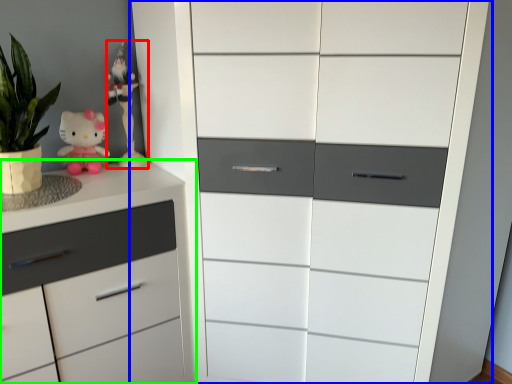
Question: Which object is the farthest from miniature (highlighted by a red box)? Choose among these: chest of drawers (highlighted by a blue box) or chest of drawers (highlighted by a green box).

Choices:
 (A) chest of drawers
 (B) chest of drawers

Answer: (A)